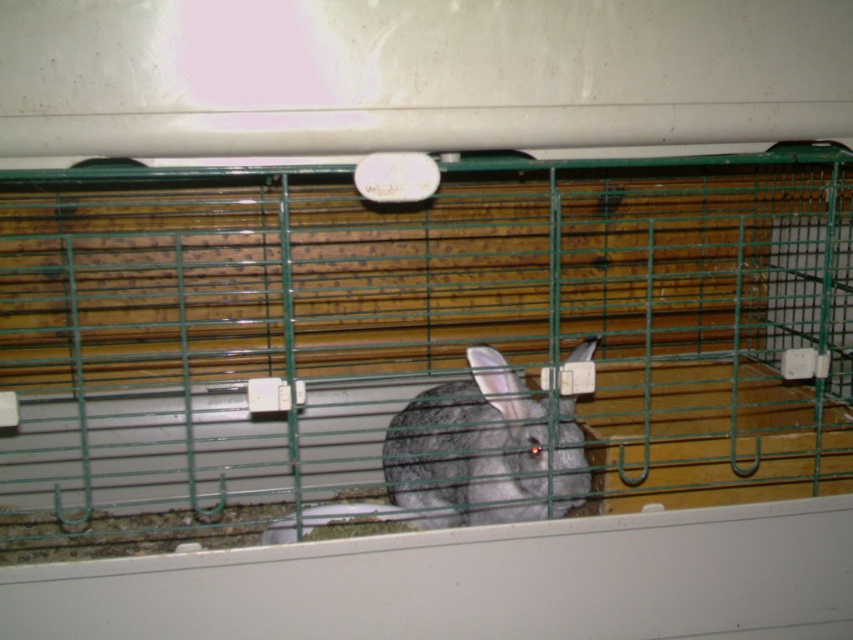
Question: Which of the following is the farthest from the observer?

Choices:
 (A) gray furry rabbit at center
 (B) green wire cage at center

Answer: (A)

Question: From the image, what is the correct spatial relationship of green wire cage at center in relation to gray furry rabbit at center?

Choices:
 (A) right
 (B) left

Answer: (B)

Question: Can you confirm if green wire cage at center is positioned below gray furry rabbit at center?

Choices:
 (A) no
 (B) yes

Answer: (A)

Question: Which of the following is the closest to the observer?

Choices:
 (A) (573, 468)
 (B) (688, 355)

Answer: (A)

Question: Is green wire cage at center bigger than gray furry rabbit at center?

Choices:
 (A) yes
 (B) no

Answer: (A)